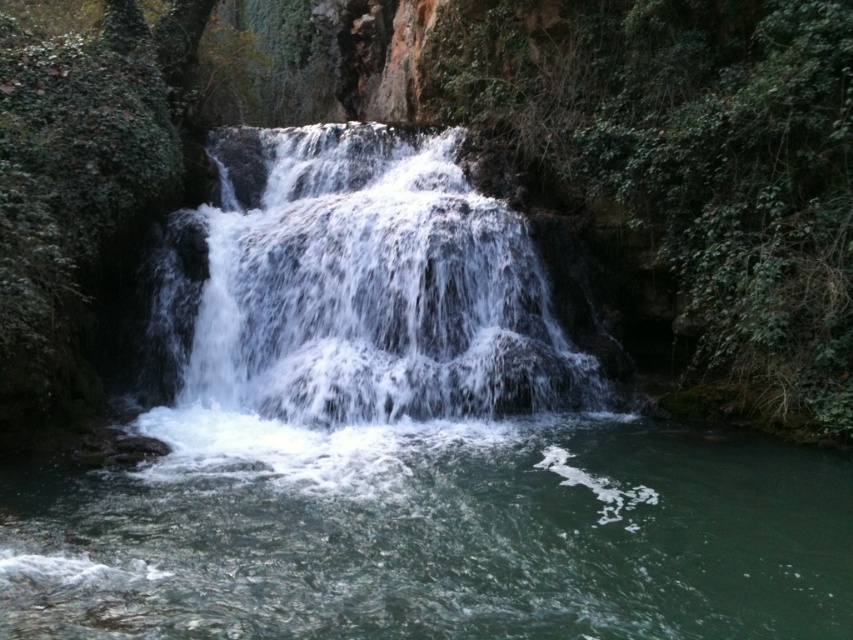
Does clear water at center have a lesser height compared to white frothy water at center?

Yes.

Is point (67, 580) closer to camera compared to point (456, 296)?

Yes, it is.

This screenshot has height=640, width=853. Identify the location of clear water at center. (432, 532).

Is green leafy vegetation at center positioned behind white frothy water at center?

No, it is in front of white frothy water at center.

Which is below, green leafy vegetation at center or white frothy water at center?

white frothy water at center

Between point (772, 138) and point (328, 340), which one is positioned behind?

Point (328, 340)

Where is `green leafy vegetation at center`? The height and width of the screenshot is (640, 853). green leafy vegetation at center is located at coordinates (689, 157).

Between clear water at center and green leafy vegetation at center, which one has less height?

clear water at center is shorter.

Can you confirm if clear water at center is thinner than green leafy vegetation at center?

Incorrect, clear water at center's width is not less than green leafy vegetation at center's.

Measure the distance between clear water at center and camera.

clear water at center is 9.79 meters from camera.

The image size is (853, 640). Find the location of `clear water at center`. clear water at center is located at coordinates tap(432, 532).